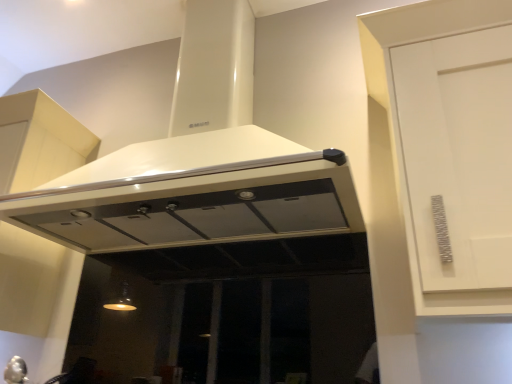
Image resolution: width=512 pixels, height=384 pixels. I want to click on white glossy range hood at center, so (x=189, y=159).

Describe the element at coordinates (189, 159) in the screenshot. I see `white glossy range hood at center` at that location.

This screenshot has width=512, height=384. Find the location of `white glossy range hood at center`. white glossy range hood at center is located at coordinates (189, 159).